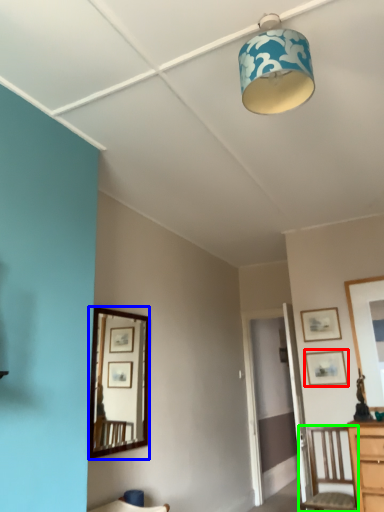
Question: Considering the real-world distances, which object is closest to picture frame (highlighted by a red box)? mirror (highlighted by a blue box) or chair (highlighted by a green box).

Choices:
 (A) mirror
 (B) chair

Answer: (B)